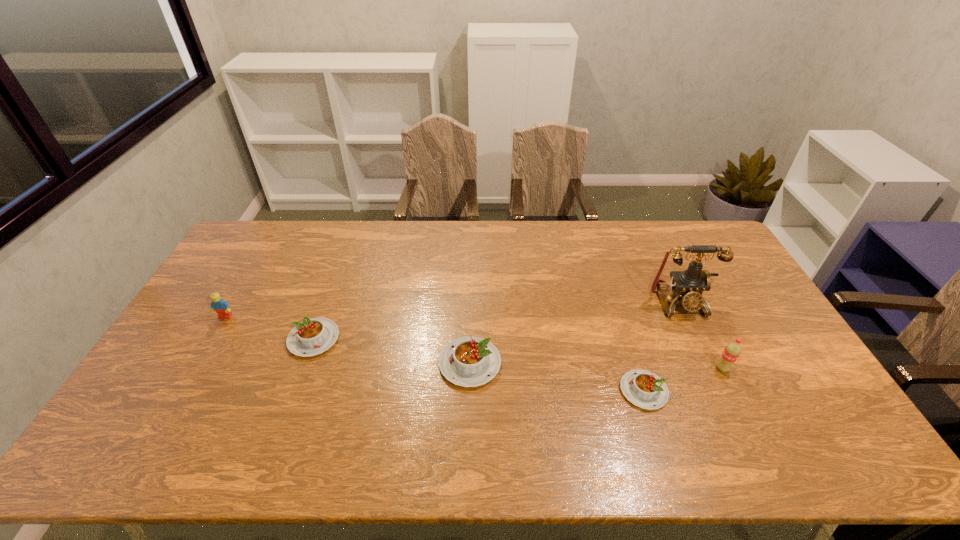
Please point a free position for a pudding on the right. Please provide its 2D coordinates. Your answer should be formatted as a tuple, i.e. [(x, y)], where the tuple contains the x and y coordinates of a point satisfying the conditions above.

[(838, 421)]